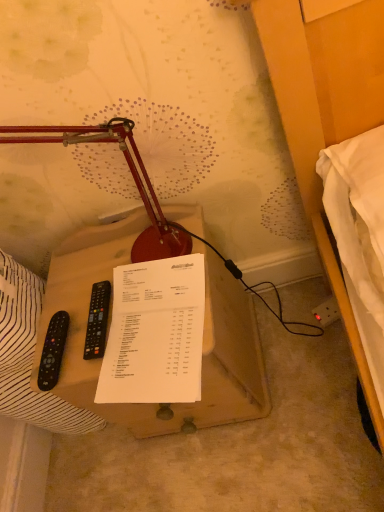
What are the coordinates of `free space behind black plastic remote at left, the second remote control in the right-to-left sequence` in the screenshot? It's located at (64, 288).